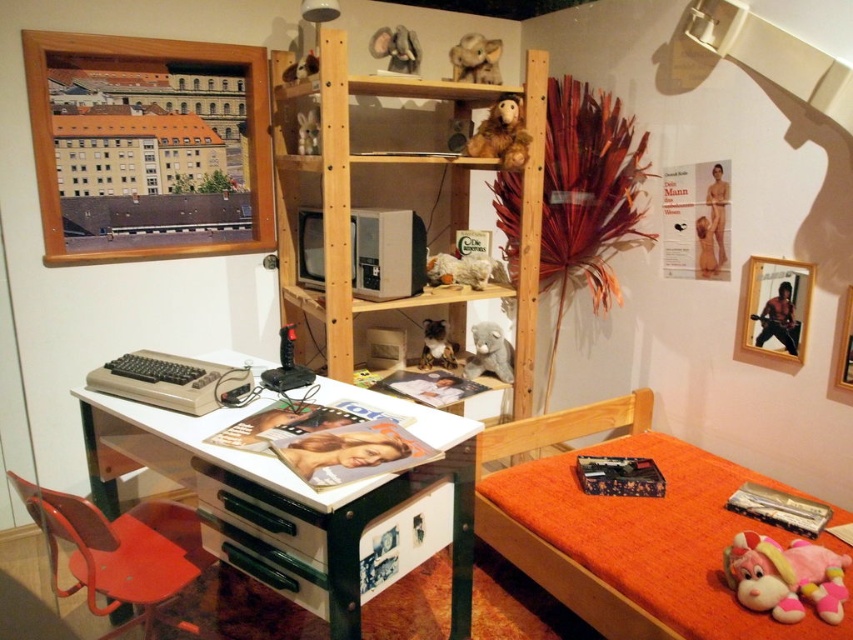
Question: Does brown plush monkey at upper center have a larger size compared to fuzzy gray teddy bear at center?

Choices:
 (A) yes
 (B) no

Answer: (A)

Question: Which of the following is the farthest from the observer?

Choices:
 (A) orange fabric bed at lower right
 (B) fuzzy brown elephant at upper center
 (C) soft plush elephant at upper center

Answer: (B)

Question: Considering the relative positions of white plastic computer desk at center and fuzzy brown elephant at upper center in the image provided, where is white plastic computer desk at center located with respect to fuzzy brown elephant at upper center?

Choices:
 (A) above
 (B) below

Answer: (B)

Question: Does white plastic computer desk at center appear on the left side of plush pink unicorn at lower right?

Choices:
 (A) no
 (B) yes

Answer: (B)

Question: Estimate the real-world distances between objects in this image. Which object is farther from the woodenmaterial/texture bookshelf at upper center?

Choices:
 (A) shiny silver picture frame at upper right
 (B) fuzzy gray teddy bear at center
 (C) fuzzy fabric stuffed animal at center
 (D) orange fabric bed at lower right

Answer: (A)

Question: Which object is closer to the camera taking this photo?

Choices:
 (A) metallic silver picture frame at upper right
 (B) brown plush monkey at upper center
 (C) orange fabric bed at lower right
 (D) soft plush elephant at upper center

Answer: (C)